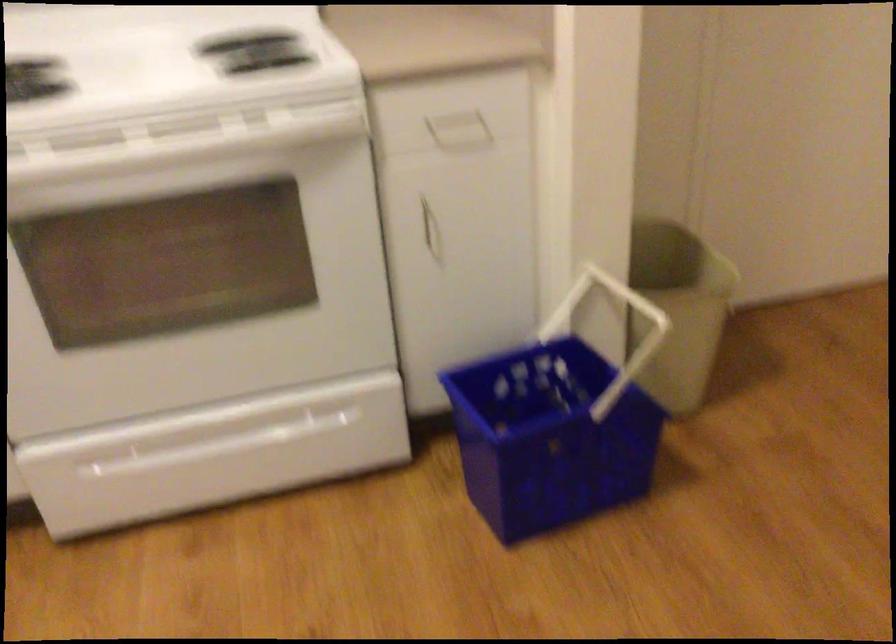
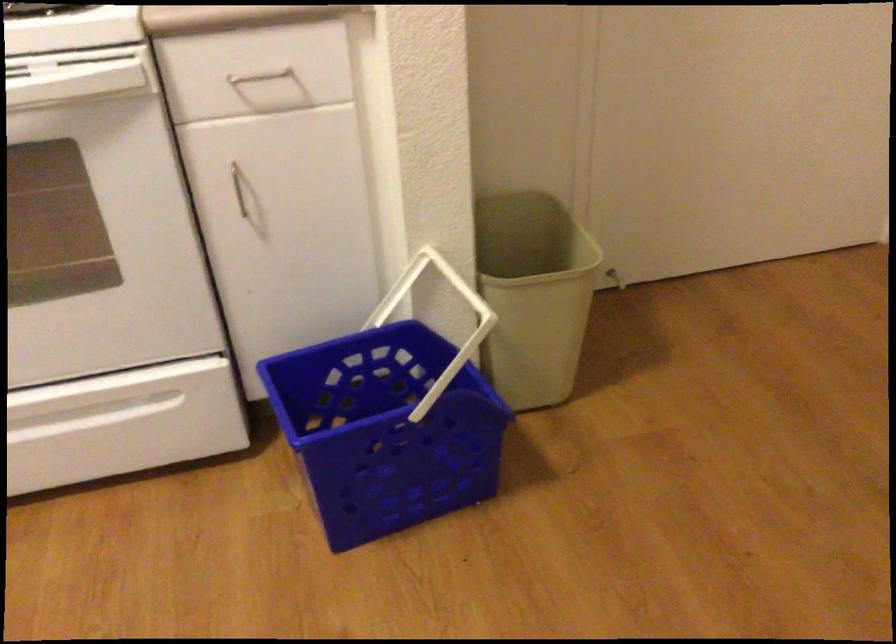
In a continuous first-person perspective shot, in which direction is the camera moving?

The cameraman walked toward right, forward.